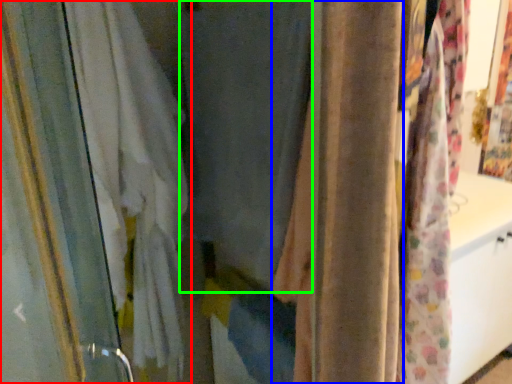
Question: Considering the real-world distances, which object is closest to curtain (highlighted by a red box)? curtain (highlighted by a blue box) or curtain (highlighted by a green box).

Choices:
 (A) curtain
 (B) curtain

Answer: (B)